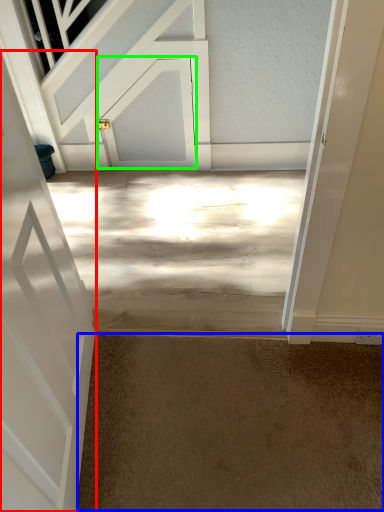
Question: Estimate the real-world distances between objects in this image. Which object is farther from door (highlighted by a red box), concrete (highlighted by a blue box) or door (highlighted by a green box)?

Choices:
 (A) concrete
 (B) door

Answer: (B)